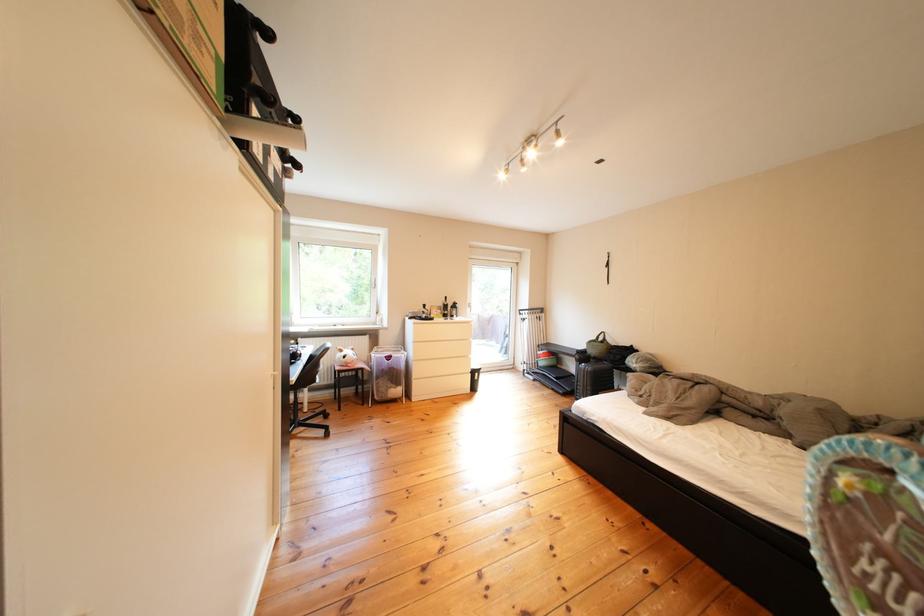
I want to click on stuffed animal toy, so click(x=347, y=360).